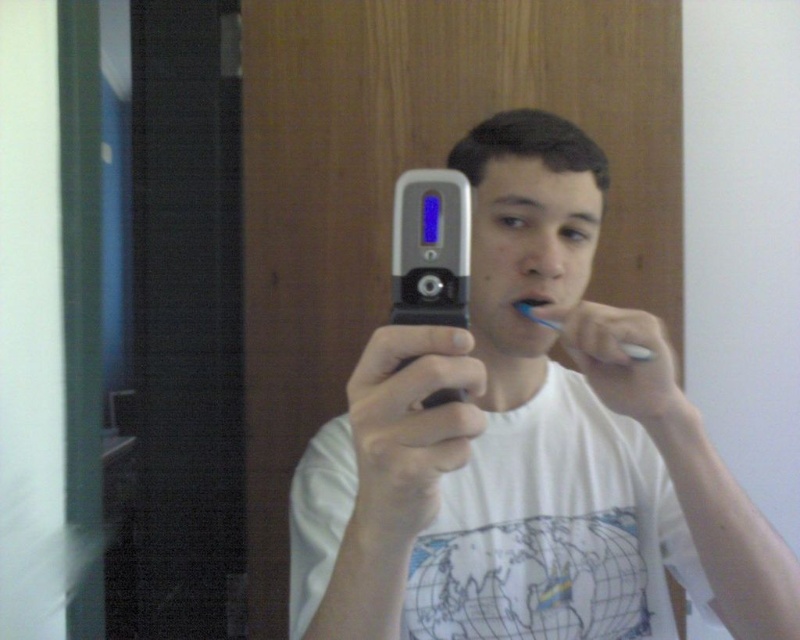
Can you confirm if silver metallic flip phone at center is positioned below silver metallic phone at center?

Yes.

Measure the distance from silver metallic flip phone at center to silver metallic phone at center.

silver metallic flip phone at center and silver metallic phone at center are 9.40 inches apart from each other.

At what (x,y) coordinates should I click in order to perform the action: click on silver metallic flip phone at center. Please return your answer as a coordinate pair (x, y). The width and height of the screenshot is (800, 640). Looking at the image, I should click on (526, 449).

Is blue plastic toothbrush at upper center wider than matte plastic toothbrush at center?

Indeed, blue plastic toothbrush at upper center has a greater width compared to matte plastic toothbrush at center.

Who is more distant from viewer, (526, 310) or (536, 296)?

Point (536, 296)

Is point (638, 353) positioned after point (534, 300)?

No, (638, 353) is closer to viewer.

What are the coordinates of `blue plastic toothbrush at upper center` in the screenshot? It's located at (534, 316).

Looking at this image, which is above, silver metallic phone at center or matte plastic toothbrush at center?

silver metallic phone at center is higher up.

Can you confirm if silver metallic phone at center is taller than matte plastic toothbrush at center?

Yes, silver metallic phone at center is taller than matte plastic toothbrush at center.

Find the location of a particular element. This screenshot has height=640, width=800. silver metallic phone at center is located at coordinates (430, 248).